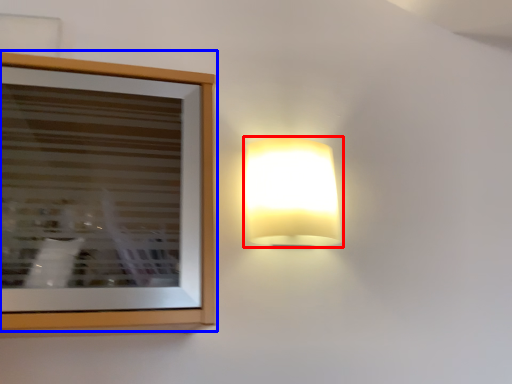
Question: Among these objects, which one is farthest to the camera, lamp (highlighted by a red box) or picture frame (highlighted by a blue box)?

Choices:
 (A) lamp
 (B) picture frame

Answer: (A)